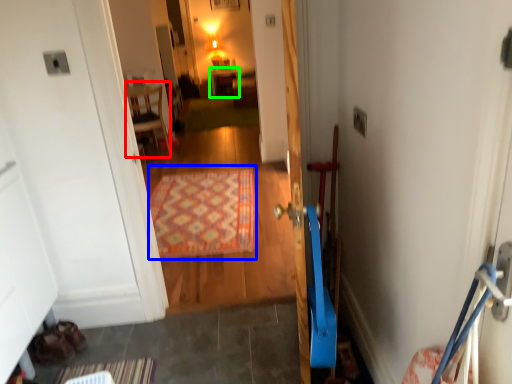
Question: Based on their relative distances, which object is nearer to furniture (highlighted by a red box)? Choose from doormat (highlighted by a blue box) and furniture (highlighted by a green box).

Choices:
 (A) doormat
 (B) furniture

Answer: (A)